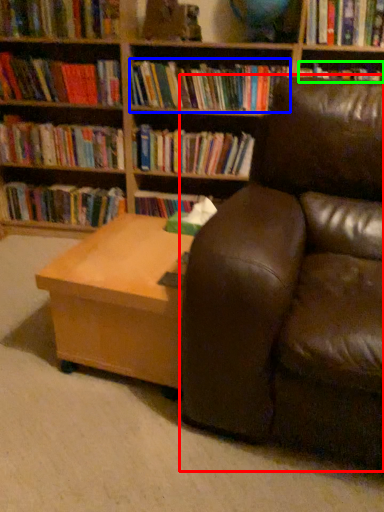
Question: Estimate the real-world distances between objects in this image. Which object is farther from studio couch (highlighted by a red box), book (highlighted by a blue box) or book (highlighted by a green box)?

Choices:
 (A) book
 (B) book

Answer: (A)